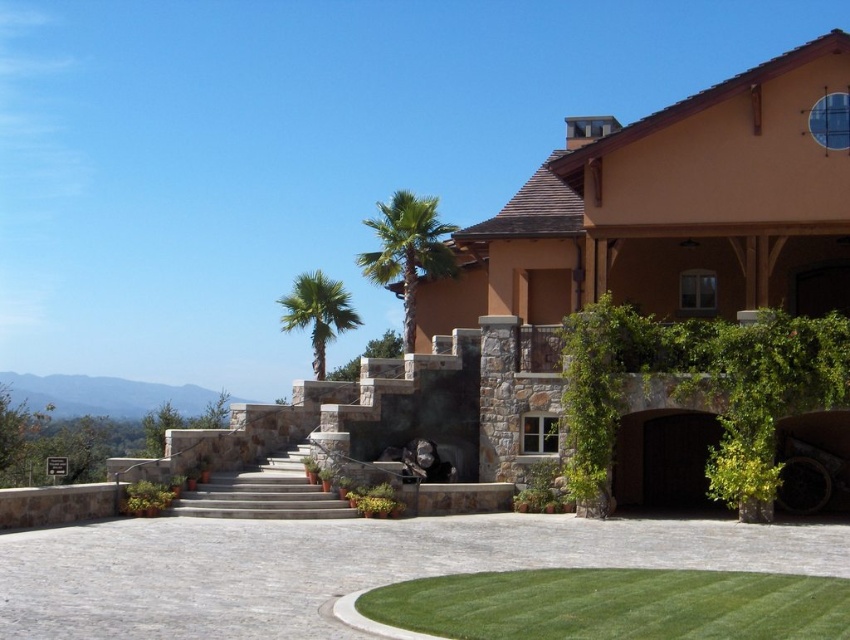
Between green grass at lower center and gray stone stairs at center, which one has more height?

With more height is gray stone stairs at center.

Between point (486, 600) and point (259, 509), which one is positioned in front?

Positioned in front is point (486, 600).

Is point (786, 582) positioned behind point (282, 456)?

No, (786, 582) is in front of (282, 456).

The width and height of the screenshot is (850, 640). I want to click on green grass at lower center, so click(615, 604).

Who is taller, green grass at lower center or green leafy palm at center?

green leafy palm at center is taller.

Is point (503, 577) less distant than point (306, 301)?

That is True.

Image resolution: width=850 pixels, height=640 pixels. What are the coordinates of `green grass at lower center` in the screenshot? It's located at click(x=615, y=604).

Between point (63, 608) and point (508, 625), which one is positioned behind?

The point (63, 608) is behind.

In the scene shown: Who is positioned more to the left, gray cobblestone driveway at center or green grass at lower center?

gray cobblestone driveway at center is more to the left.

Does point (558, 554) come closer to viewer compared to point (690, 573)?

No, it is not.

Locate an element on the screen. gray cobblestone driveway at center is located at coordinates (337, 566).